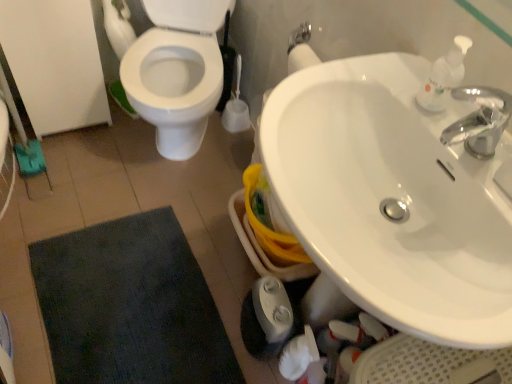
The height and width of the screenshot is (384, 512). I want to click on free space behind white plastic soap dispenser at upper right, so click(405, 72).